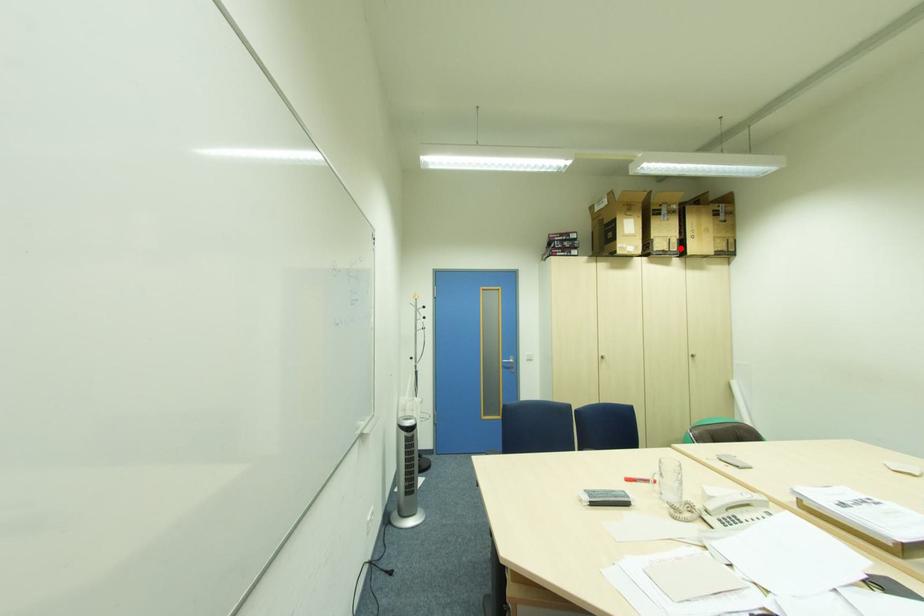
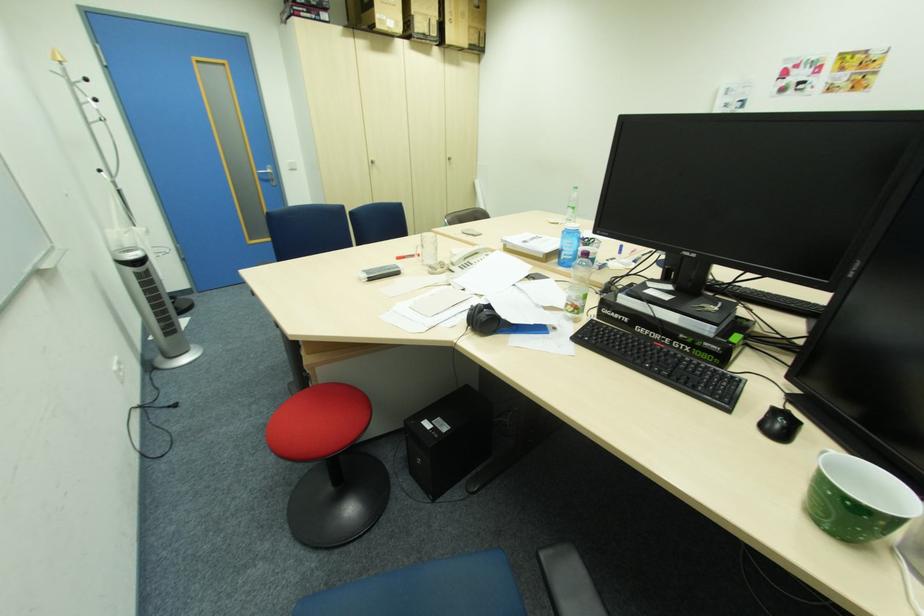
Find the pixel in the second image that matches the highlighted location in the first image.

(441, 31)